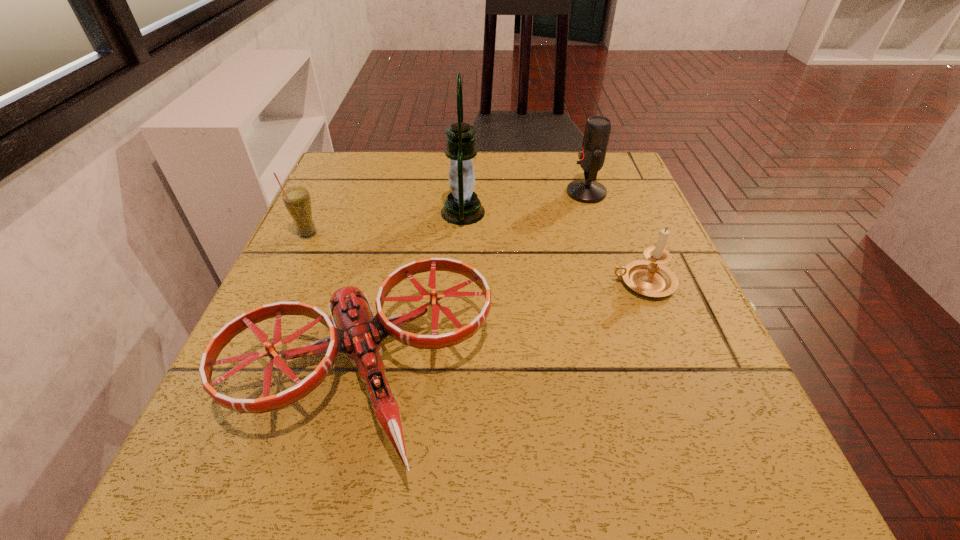
At what (x,y) coordinates should I click in order to perform the action: click on free space located 0.080m with a handle on the side of the second shortest object. Please return your answer as a coordinate pair (x, y). Looking at the image, I should click on (568, 283).

Where is `free region located with a handle on the side of the second shortest object`? This screenshot has height=540, width=960. free region located with a handle on the side of the second shortest object is located at coordinates (536, 283).

Locate an element on the screen. The width and height of the screenshot is (960, 540). free space located 0.240m with a handle on the side of the second shortest object is located at coordinates (482, 283).

Where is `vacant space situated on the back of the drone`? Image resolution: width=960 pixels, height=540 pixels. vacant space situated on the back of the drone is located at coordinates (390, 260).

The width and height of the screenshot is (960, 540). I want to click on lantern located in the far edge section of the desktop, so click(462, 207).

You are a GUI agent. You are given a task and a screenshot of the screen. Output one action in this format:
    pyautogui.click(x=<x>, y=<y>)
    Task: Click on the microphone present at the far edge
    The image size is (960, 540).
    Given the screenshot: What is the action you would take?
    pyautogui.click(x=592, y=154)

This screenshot has height=540, width=960. I want to click on object that is positioned at the near edge, so click(x=356, y=331).

The height and width of the screenshot is (540, 960). Identify the location of straw for drinking situated at the left edge. (297, 200).

Find the location of a particular element. The width and height of the screenshot is (960, 540). drone that is at the left edge is located at coordinates (356, 331).

The image size is (960, 540). What are the coordinates of `microphone situated at the right edge` in the screenshot? It's located at (592, 154).